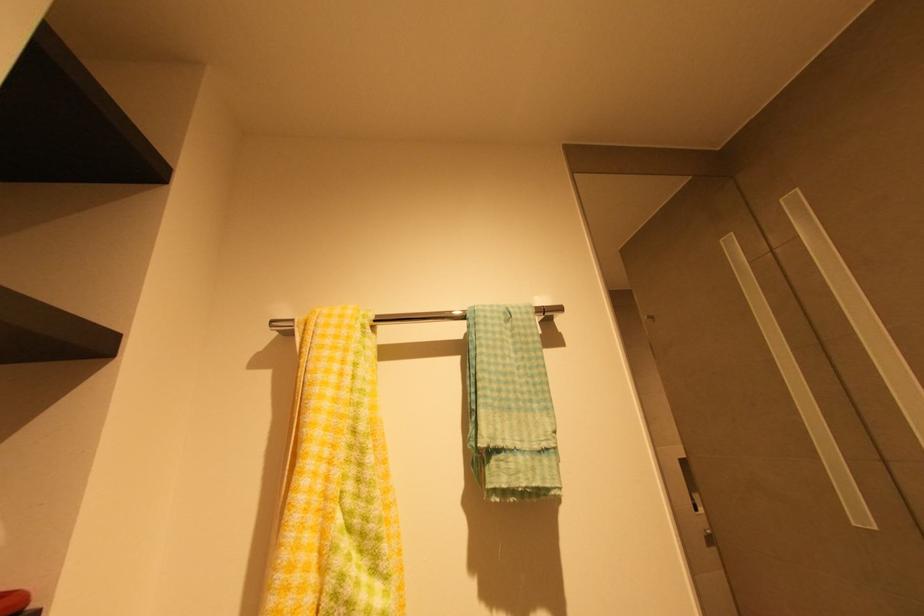
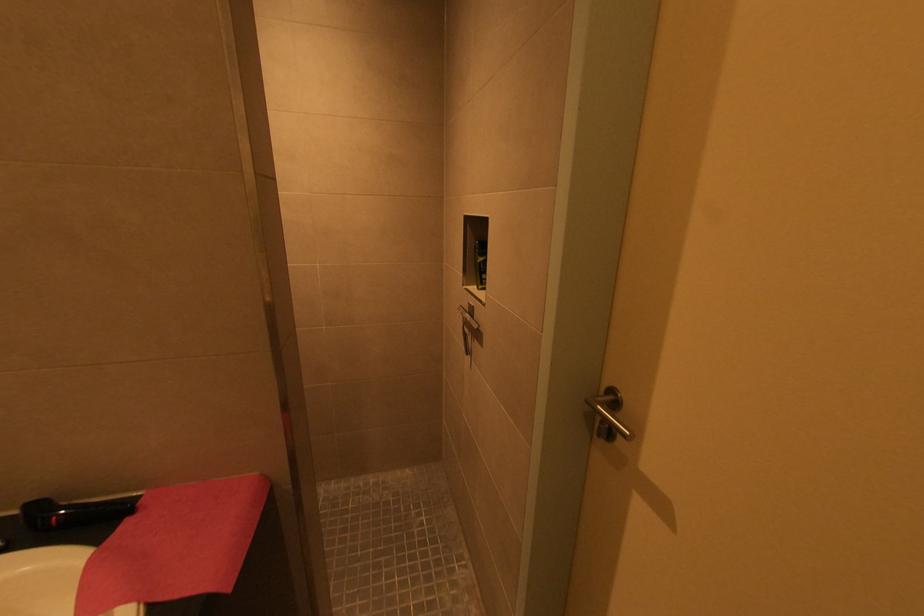
Question: The camera is either moving clockwise (left) or counter-clockwise (right) around the object. The first image is from the beginning of the video and the second image is from the end. Is the camera moving left or right when shooting the video?

Choices:
 (A) Left
 (B) Right

Answer: (A)